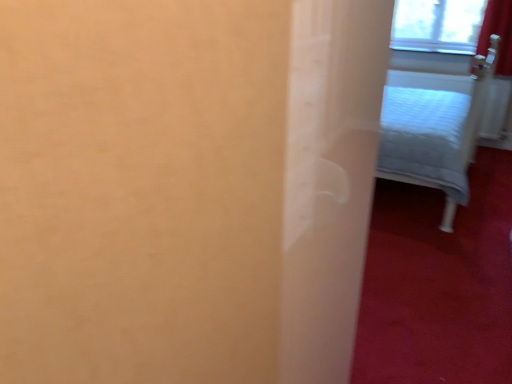
This screenshot has width=512, height=384. What do you see at coordinates (437, 25) in the screenshot?
I see `transparent glass window at upper right` at bounding box center [437, 25].

This screenshot has width=512, height=384. What are the coordinates of `transparent glass window at upper right` in the screenshot? It's located at (x=437, y=25).

The height and width of the screenshot is (384, 512). Describe the element at coordinates (434, 129) in the screenshot. I see `light gray fabric bed at upper right` at that location.

Locate an element on the screen. light gray fabric bed at upper right is located at coordinates (434, 129).

Locate an element on the screen. transparent glass window at upper right is located at coordinates (437, 25).

Between light gray fabric bed at upper right and transparent glass window at upper right, which one appears on the right side from the viewer's perspective?

transparent glass window at upper right.

Relative to transparent glass window at upper right, is light gray fabric bed at upper right in front or behind?

Visually, light gray fabric bed at upper right is located in front of transparent glass window at upper right.

Is point (476, 112) closer or farther from the camera than point (460, 26)?

Point (476, 112).

From the image's perspective, does light gray fabric bed at upper right appear lower than transparent glass window at upper right?

Correct, light gray fabric bed at upper right appears lower than transparent glass window at upper right in the image.

From a real-world perspective, is light gray fabric bed at upper right located beneath transparent glass window at upper right?

Indeed, from a real-world perspective, light gray fabric bed at upper right is positioned beneath transparent glass window at upper right.

Is light gray fabric bed at upper right wider or thinner than transparent glass window at upper right?

light gray fabric bed at upper right is wider than transparent glass window at upper right.

Considering the sizes of light gray fabric bed at upper right and transparent glass window at upper right in the image, is light gray fabric bed at upper right taller or shorter than transparent glass window at upper right?

light gray fabric bed at upper right is taller than transparent glass window at upper right.

Does light gray fabric bed at upper right have a larger size compared to transparent glass window at upper right?

Yes, light gray fabric bed at upper right is bigger than transparent glass window at upper right.

Choose the correct answer: Is light gray fabric bed at upper right inside transparent glass window at upper right or outside it?

light gray fabric bed at upper right is not inside transparent glass window at upper right, it's outside.

Is light gray fabric bed at upper right far away from transparent glass window at upper right?

light gray fabric bed at upper right is positioned a significant distance from transparent glass window at upper right.

Is transparent glass window at upper right at the back of light gray fabric bed at upper right?

No, light gray fabric bed at upper right is not facing the opposite direction of transparent glass window at upper right.

What's the angular difference between light gray fabric bed at upper right and transparent glass window at upper right's facing directions?

They differ by 91.3 degrees in their facing directions.

Where is `window above the light gray fabric bed at upper right (from the image's perspective)`? This screenshot has width=512, height=384. window above the light gray fabric bed at upper right (from the image's perspective) is located at coordinates (437, 25).

Does transparent glass window at upper right appear on the right side of light gray fabric bed at upper right?

Yes.

Is transparent glass window at upper right in front of light gray fabric bed at upper right?

No, transparent glass window at upper right is further to the viewer.

Considering the positions of points (468, 33) and (440, 108), is point (468, 33) farther from camera compared to point (440, 108)?

Yes, point (468, 33) is farther from viewer.

From the image's perspective, is transparent glass window at upper right above or below light gray fabric bed at upper right?

transparent glass window at upper right is above light gray fabric bed at upper right.

From a real-world perspective, relative to light gray fabric bed at upper right, is transparent glass window at upper right vertically above or below?

Clearly, from a real-world perspective, transparent glass window at upper right is above light gray fabric bed at upper right.

Is transparent glass window at upper right thinner than light gray fabric bed at upper right?

Correct, the width of transparent glass window at upper right is less than that of light gray fabric bed at upper right.

From their relative heights in the image, would you say transparent glass window at upper right is taller or shorter than light gray fabric bed at upper right?

transparent glass window at upper right is shorter than light gray fabric bed at upper right.

Considering the sizes of transparent glass window at upper right and light gray fabric bed at upper right in the image, is transparent glass window at upper right bigger or smaller than light gray fabric bed at upper right?

transparent glass window at upper right is smaller than light gray fabric bed at upper right.

Could light gray fabric bed at upper right be considered to be inside transparent glass window at upper right?

Actually, light gray fabric bed at upper right is outside transparent glass window at upper right.

Looking at this image, is transparent glass window at upper right not close to light gray fabric bed at upper right?

Yes, transparent glass window at upper right and light gray fabric bed at upper right are quite far apart.

Is transparent glass window at upper right facing towards light gray fabric bed at upper right?

Yes.

Locate an element on the screen. The width and height of the screenshot is (512, 384). furniture below the transparent glass window at upper right (from the image's perspective) is located at coordinates (434, 129).

Identify the location of window that is behind the light gray fabric bed at upper right. Image resolution: width=512 pixels, height=384 pixels. (437, 25).

At what (x,y) coordinates should I click in order to perform the action: click on window that appears above the light gray fabric bed at upper right (from the image's perspective). Please return your answer as a coordinate pair (x, y). Image resolution: width=512 pixels, height=384 pixels. Looking at the image, I should click on (437, 25).